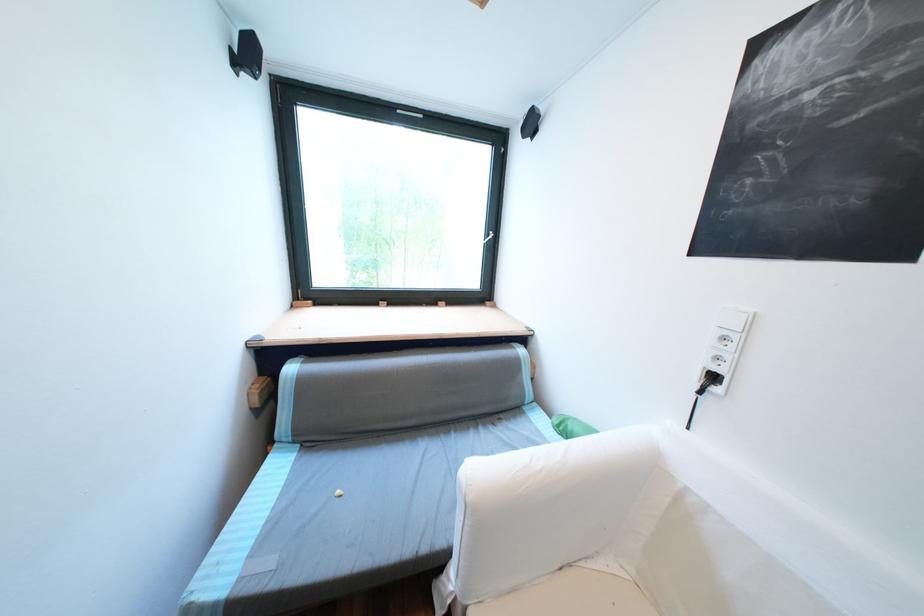
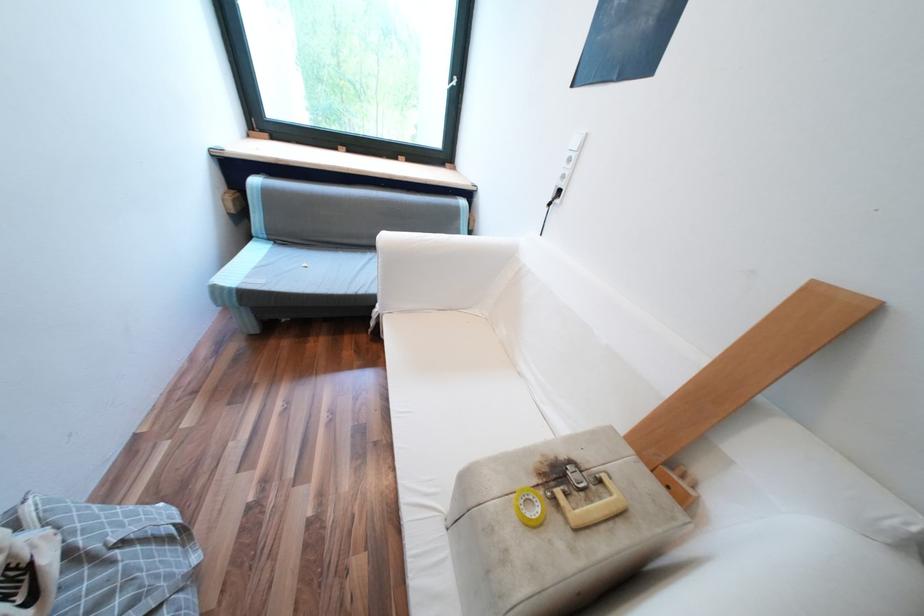
Question: Based on the continuous images, in which direction is the camera rotating? Reply with the corresponding letter.

Choices:
 (A) Left
 (B) Right
 (C) Up
 (D) Down

Answer: (D)